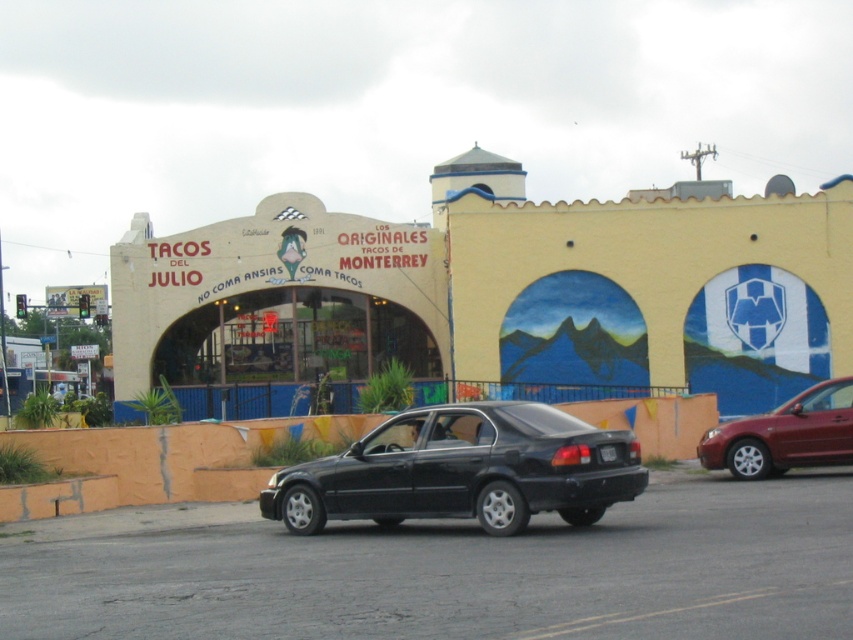
You are standing in front of the restaurant with the yellow facade and blue accents. You notice two points marked on the building. One is at coordinate point (265, 486) and the other at point (809, 448). Which point is closer to you?

Point (265, 486) is closer to you because it is further to the camera than point (809, 448).

You are standing in front of the TACOS DEL JULIO restaurant. You notice two points marked on the building facade. The first point is at coordinates point (544, 500) and the second is at point (602, 445). From your perspective, which point is closer to you?

Point (544, 500) is in front of point (602, 445), so it is closer to you.

You are a delivery person who needs to park your 4.5 meter long truck between the two sedans. The matte black sedan at center and the maroon metallic sedan at right are parked parallel to each other. Can you fit your truck between them without overlapping either vehicle?

The matte black sedan at center is shorter than the maroon metallic sedan at right, so the space between them may be sufficient. However, since the truck is 4.5 meters long, you need to ensure the available space between the two sedans is at least 4.5 meters. Without knowing the exact distance between the sedans, it is uncertain if the truck will fit.